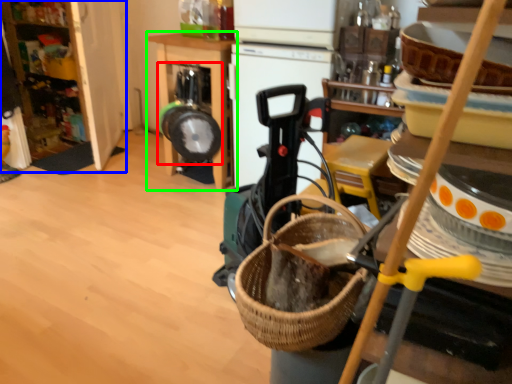
Question: Which object is positioned closest to appliance (highlighted by a red box)? Select from cabinetry (highlighted by a blue box) and furniture (highlighted by a green box).

Choices:
 (A) cabinetry
 (B) furniture

Answer: (B)